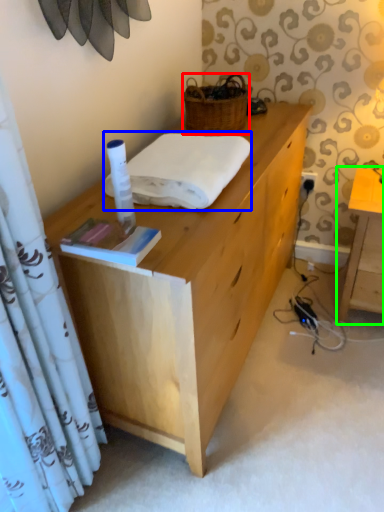
Question: Which object is positioned closest to picnic basket (highlighted by a red box)? Select from linen (highlighted by a blue box) and table (highlighted by a green box).

Choices:
 (A) linen
 (B) table

Answer: (A)